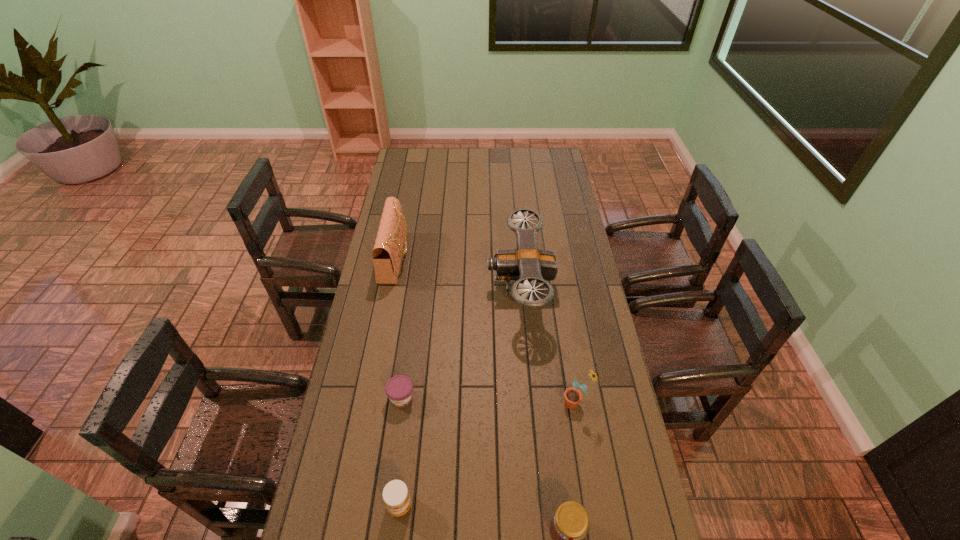
This screenshot has width=960, height=540. Identify the location of free space located 0.060m on the flower of the sunflower. (543, 403).

You are a GUI agent. You are given a task and a screenshot of the screen. Output one action in this format:
    pyautogui.click(x=<x>, y=<y>)
    Task: Click on the free location located 0.340m on the flower of the sunflower
    
    Given the screenshot: What is the action you would take?
    pyautogui.click(x=457, y=403)

I want to click on blank area located on the front label of the shortest jam, so click(392, 471).

You are a GUI agent. You are given a task and a screenshot of the screen. Output one action in this format:
    pyautogui.click(x=<x>, y=<y>)
    Task: Click on the handbag situated at the left edge
    The width and height of the screenshot is (960, 540).
    Given the screenshot: What is the action you would take?
    pyautogui.click(x=388, y=249)

Locate an element on the screen. This screenshot has width=960, height=540. jam that is at the left edge is located at coordinates (399, 389).

You are a GUI agent. You are given a task and a screenshot of the screen. Output one action in this format:
    pyautogui.click(x=<x>, y=<y>)
    Task: Click on the drone present at the right edge
    Image resolution: width=960 pixels, height=540 pixels.
    Given the screenshot: What is the action you would take?
    point(527,264)

Locate an element on the screen. This screenshot has height=540, width=960. sunflower located at the right edge is located at coordinates (572, 396).

Locate an element on the screen. The image size is (960, 540). blank space at the far edge of the desktop is located at coordinates (451, 172).

This screenshot has width=960, height=540. Find the location of `free space at the left edge of the desktop`. free space at the left edge of the desktop is located at coordinates [x=334, y=424].

Where is `free space at the right edge of the desktop`? This screenshot has height=540, width=960. free space at the right edge of the desktop is located at coordinates (541, 186).